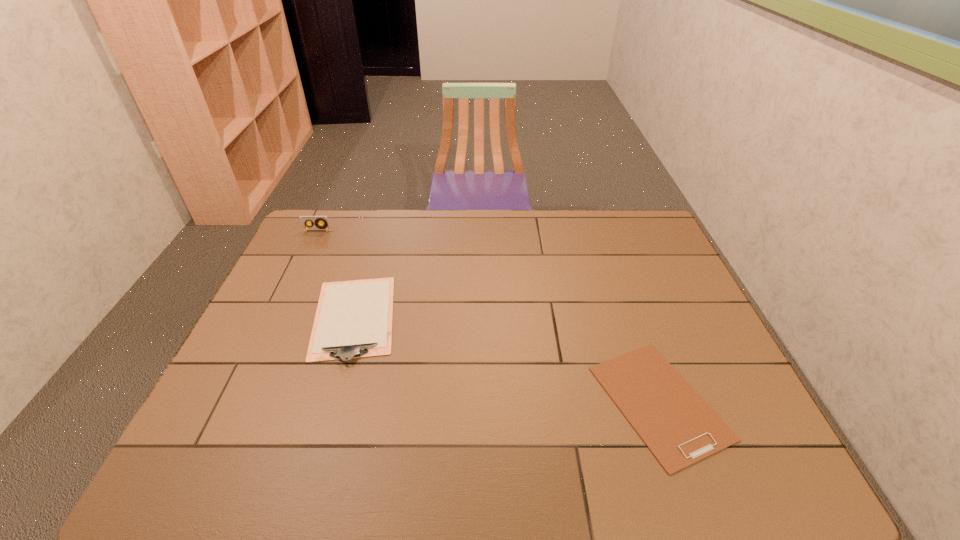
In the image, there is a desktop. What are the coordinates of `vacant area at the far left corner` in the screenshot? It's located at (333, 245).

You are a GUI agent. You are given a task and a screenshot of the screen. Output one action in this format:
    pyautogui.click(x=<x>, y=<y>)
    Task: Click on the free space at the far right corner
    This screenshot has width=960, height=540.
    Given the screenshot: What is the action you would take?
    pyautogui.click(x=650, y=220)

You are a GUI agent. You are given a task and a screenshot of the screen. Output one action in this format:
    pyautogui.click(x=<x>, y=<y>)
    Task: Click on the blank space at the near right corner of the desktop
    
    Given the screenshot: What is the action you would take?
    click(718, 457)

Locate an element on the screen. The height and width of the screenshot is (540, 960). vacant region between the farthest object and the right clipboard is located at coordinates (489, 316).

I want to click on vacant area that lies between the shortest object and the tallest object, so click(x=489, y=316).

Where is `unoccupied position between the second object from left to right and the tallest object`? unoccupied position between the second object from left to right and the tallest object is located at coordinates (336, 274).

Identify the location of free space that is in between the right clipboard and the second shortest object. The height and width of the screenshot is (540, 960). (507, 360).

Locate an element on the screen. free space between the shortest object and the second object from right to left is located at coordinates [x=507, y=360].

The height and width of the screenshot is (540, 960). Identify the location of free space between the rightmost object and the second tallest object. (507, 360).

In order to click on vacant point located between the tallest object and the left clipboard in this screenshot , I will do `click(336, 274)`.